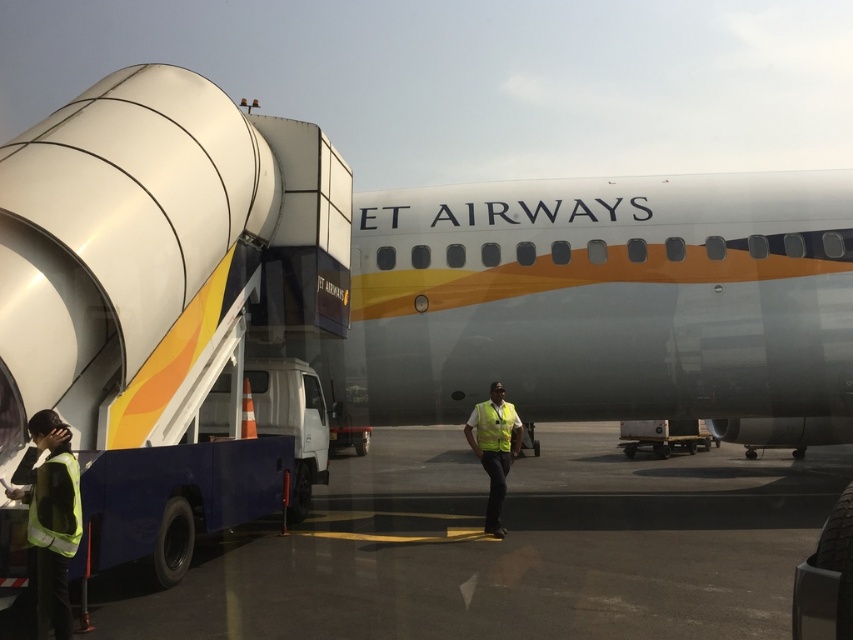
Question: Does yellow reflective vest at center have a lesser width compared to yellow reflective safety vest at lower left?

Choices:
 (A) no
 (B) yes

Answer: (A)

Question: Can you confirm if yellow reflective vest at center is positioned to the left of yellow reflective safety vest at lower left?

Choices:
 (A) yes
 (B) no

Answer: (B)

Question: Which point is farther to the camera?

Choices:
 (A) yellow reflective vest at center
 (B) gray asphalt at center

Answer: (A)

Question: Which point is farther to the camera?

Choices:
 (A) silver metallic airplane at center
 (B) yellow reflective safety vest at lower left

Answer: (A)

Question: Which of the following is the closest to the observer?

Choices:
 (A) yellow reflective safety vest at lower left
 (B) gray asphalt at center
 (C) yellow reflective safety vest at center

Answer: (A)

Question: Does yellow reflective vest at center have a greater width compared to yellow reflective safety vest at lower left?

Choices:
 (A) yes
 (B) no

Answer: (A)